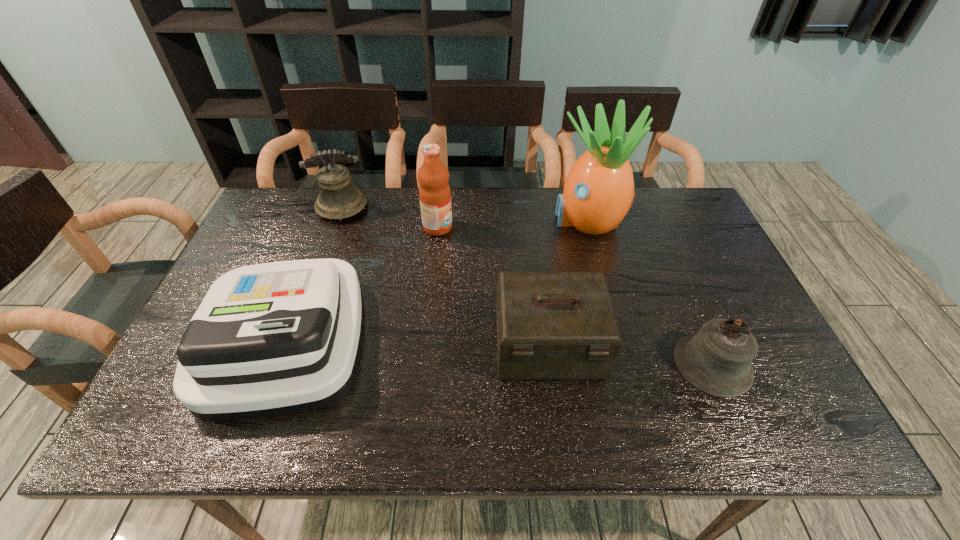
Image resolution: width=960 pixels, height=540 pixels. I want to click on free space that satisfies the following two spatial constraints: 1. at the entrance of the shorter bell; 2. on the right side of the pineapple, so click(x=626, y=364).

Where is `free region that satisfies the following two spatial constraints: 1. on the front side of the nearer bell; 2. on the right side of the first-aid kit`? This screenshot has height=540, width=960. free region that satisfies the following two spatial constraints: 1. on the front side of the nearer bell; 2. on the right side of the first-aid kit is located at coordinates (551, 364).